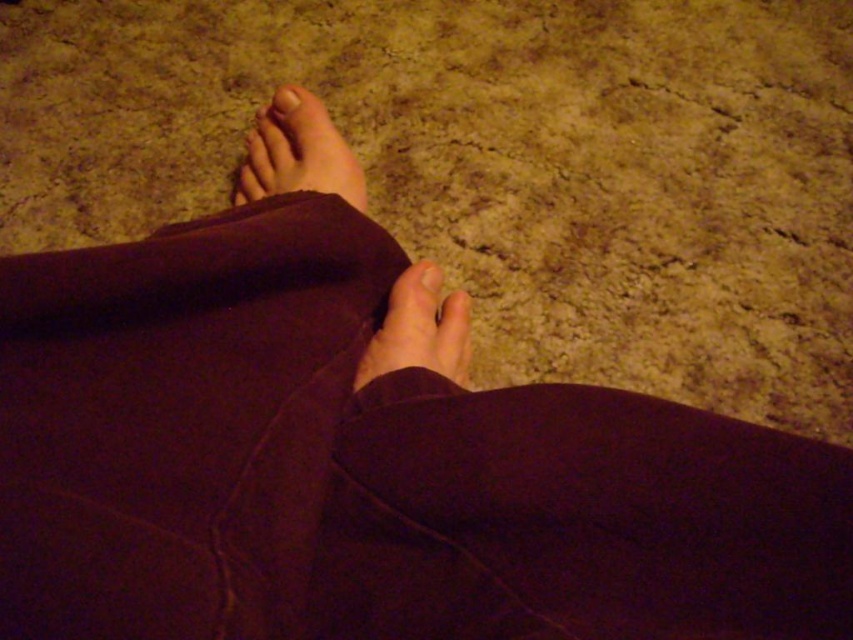
Question: Can you confirm if smooth skin foot at center is smaller than matte skin toe at upper center?

Choices:
 (A) no
 (B) yes

Answer: (A)

Question: Which of the following is the farthest from the observer?

Choices:
 (A) smooth skin toe at center
 (B) smooth skin foot at center
 (C) matte skin toe at upper center

Answer: (C)

Question: Which object is farther from the camera taking this photo?

Choices:
 (A) smooth skin toe at center
 (B) matte skin toe at upper center
 (C) matte skin toe at center
 (D) smooth skin foot at center

Answer: (B)

Question: Is matte skin foot at upper center bigger than matte skin toe at center?

Choices:
 (A) no
 (B) yes

Answer: (B)

Question: Does matte skin toe at upper center appear on the left side of matte skin toe at center?

Choices:
 (A) yes
 (B) no

Answer: (A)

Question: Which point is closer to the camera?

Choices:
 (A) (287, 97)
 (B) (440, 275)

Answer: (B)